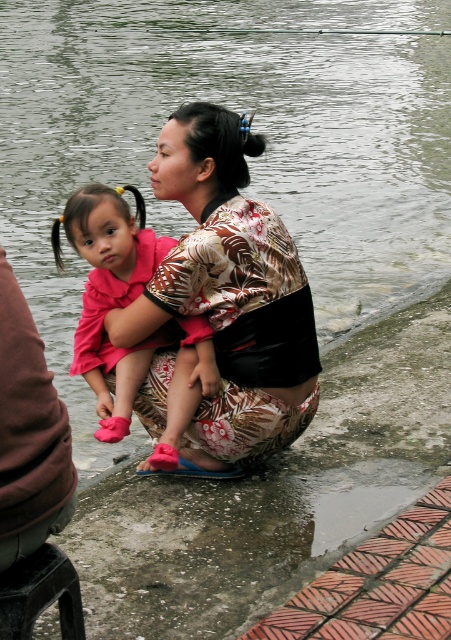
You are a photographer trying to capture the printed fabric kimono at center and the wooden stool at lower left in the same frame. Which object should you focus on first to ensure both are in focus?

The printed fabric kimono at center is closer to the viewer than the wooden stool at lower left, so focus on the kimono first to ensure both are in focus.

You are a photographer taking a picture of the printed fabric kimono at center and the wooden stool at lower left. Which object should you focus on first if you want to capture both in the same frame?

The printed fabric kimono at center is above the wooden stool at lower left, so you should focus on the printed fabric kimono at center first to ensure both are in the frame.

You are a photographer standing in front of the scene. You want to take a photo of the brown fabric squat at lower left and the wooden stool at lower left. Which object will appear larger in the photo?

The brown fabric squat at lower left will appear larger in the photo because it is closer to the viewer than the wooden stool at lower left.